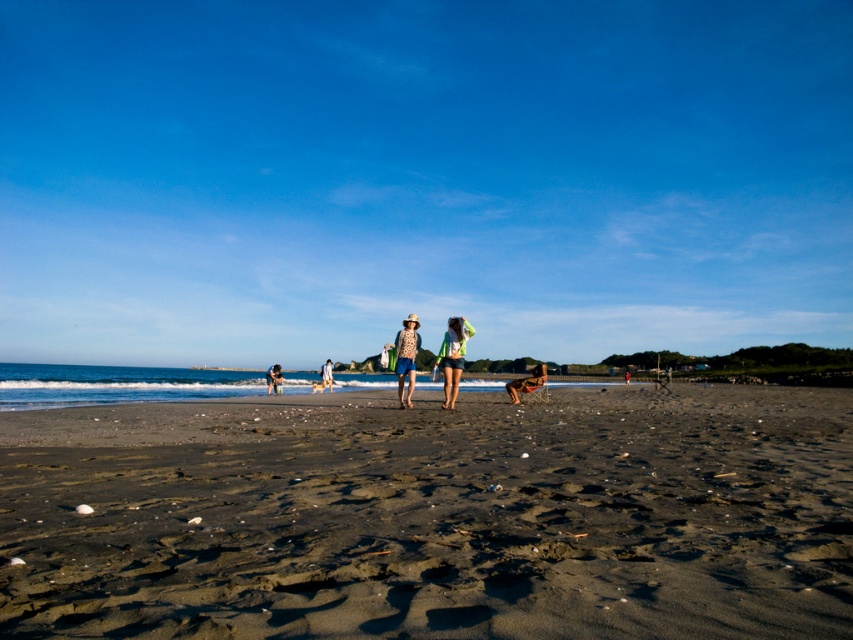
Is dark brown sand at center wider than blue denim shorts at center?

Yes, dark brown sand at center is wider than blue denim shorts at center.

Does dark brown sand at center appear over blue denim shorts at center?

Yes, dark brown sand at center is above blue denim shorts at center.

The height and width of the screenshot is (640, 853). I want to click on dark brown sand at center, so click(433, 516).

Locate an element on the screen. This screenshot has width=853, height=640. dark brown sand at center is located at coordinates (433, 516).

From the picture: Can you confirm if green fabric shorts at center is taller than blue denim shorts at center?

Indeed, green fabric shorts at center has a greater height compared to blue denim shorts at center.

Can you confirm if green fabric shorts at center is positioned to the left of blue denim shorts at center?

No, green fabric shorts at center is not to the left of blue denim shorts at center.

Is point (447, 385) farther from viewer compared to point (276, 384)?

No, it is not.

Where is `green fabric shorts at center`? green fabric shorts at center is located at coordinates coord(453,356).

Is brown fur dog at center smaller than green fabric bag at center?

Yes, brown fur dog at center is smaller than green fabric bag at center.

Who is higher up, brown fur dog at center or green fabric bag at center?

brown fur dog at center

Does point (532, 378) come in front of point (625, 378)?

Yes, point (532, 378) is closer to viewer.

At what (x,y) coordinates should I click in order to perform the action: click on brown fur dog at center. Please return your answer as a coordinate pair (x, y). The image size is (853, 640). Looking at the image, I should click on (526, 381).